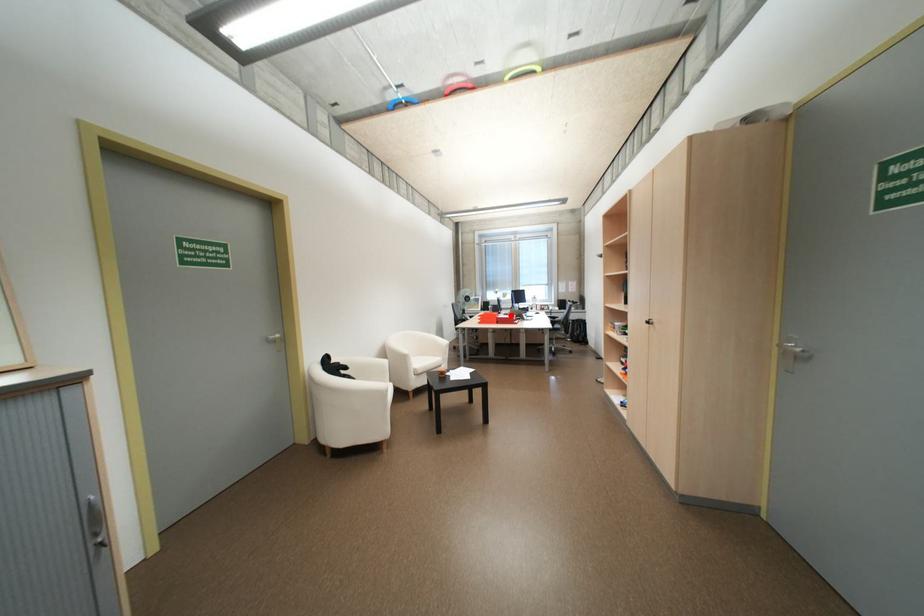
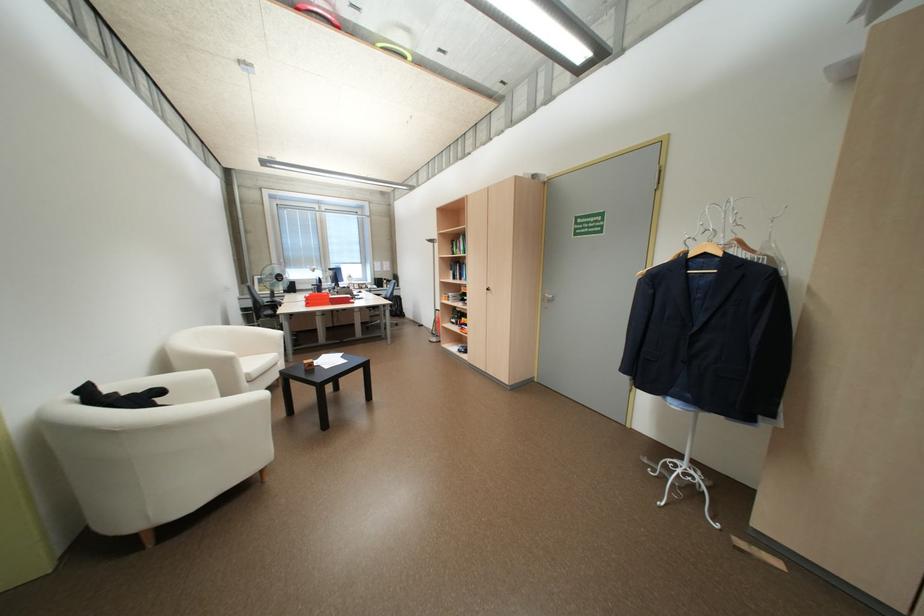
Question: I am providing you with two images of the same scene from different viewpoints. Given a red point in image1, look at the same physical point in image2. Is it:

Choices:
 (A) Closer to the viewpoint
 (B) Farther from the viewpoint

Answer: (A)